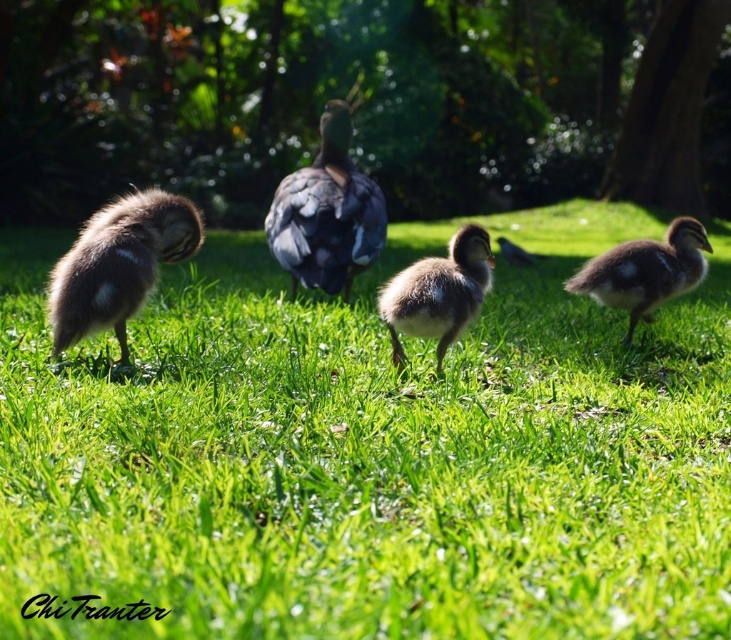
Question: Is dark gray matte duck at center in front of brown fluffy duckling at right?

Choices:
 (A) yes
 (B) no

Answer: (B)

Question: Which object is closer to the camera taking this photo?

Choices:
 (A) dark gray matte duck at center
 (B) soft brown downy duckling at center
 (C) green soft grass at center

Answer: (C)

Question: Which of the following is the farthest from the observer?

Choices:
 (A) (439, 330)
 (B) (148, 452)

Answer: (A)

Question: Does green soft grass at center appear on the right side of brown fluffy duckling at right?

Choices:
 (A) no
 (B) yes

Answer: (A)

Question: Is dark gray matte duck at center closer to camera compared to soft brown downy duckling at center?

Choices:
 (A) yes
 (B) no

Answer: (B)

Question: Which point is closer to the camera?

Choices:
 (A) brown fluffy duckling at left
 (B) soft brown downy duckling at center
 (C) dark gray matte duck at center

Answer: (A)